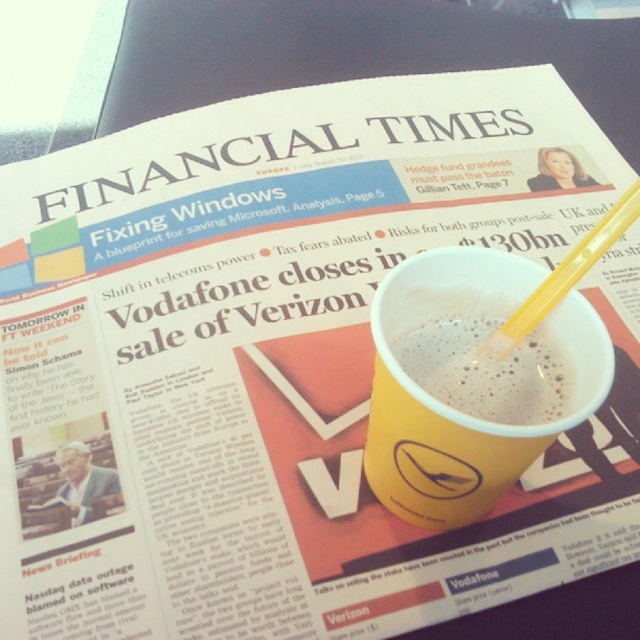
You are at a coffee shop and see a Financial Times newspaper with a yellow paper cup at center. The newspaper mentions an article about Microsoft on page 5 and another about Vodafone on page 7. If you want to read the article about Microsoft first, then the Vodafone sale, which page should you turn to after finishing page 5?

After reading page 5 about Microsoft, you should turn to page 7 to read about the Vodafone sale.

You are at a coffee shop and see the Financial Times newspaper on the table with a yellow paper cup at center and a yellow plastic straw at upper right. Which object is larger?

The yellow paper cup at center is bigger than the yellow plastic straw at upper right.

You are at a cafe and want to place your white frothy coffee at center into the yellow paper cup at center. Can you fit the coffee into the cup without spilling?

The yellow paper cup at center might be wider than white frothy coffee at center, so there is a possibility that the coffee can fit without spilling, but it depends on the volume of the coffee and the cup size. However, since the cup is wider, the coffee might not overflow if poured carefully.